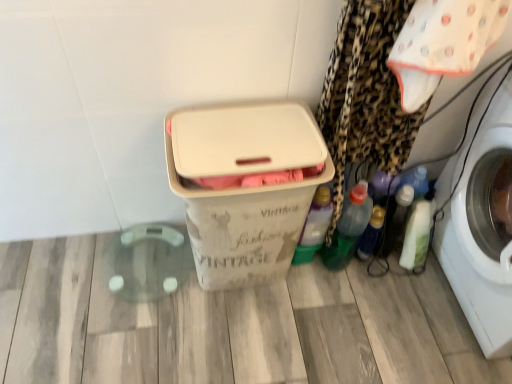
Image resolution: width=512 pixels, height=384 pixels. Identify the location of vacant area to the left of translucent plastic bottle at lower right, the second bottle in the right-to-left sequence. (330, 273).